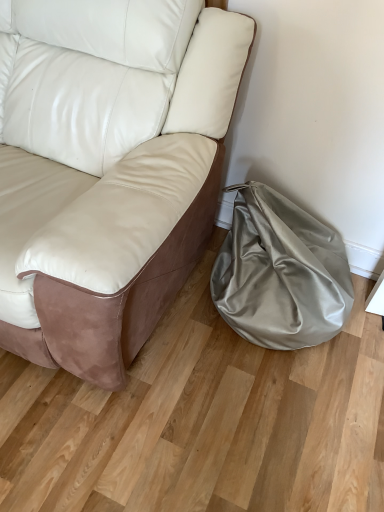
Question: In the image, is satin beige bean bag at lower right on the left side or the right side of white leather couch at center?

Choices:
 (A) right
 (B) left

Answer: (A)

Question: Considering the positions of satin beige bean bag at lower right and white leather couch at center in the image, is satin beige bean bag at lower right wider or thinner than white leather couch at center?

Choices:
 (A) wide
 (B) thin

Answer: (B)

Question: From the image's perspective, relative to white leather couch at center, is satin beige bean bag at lower right above or below?

Choices:
 (A) below
 (B) above

Answer: (A)

Question: From a real-world perspective, relative to satin beige bean bag at lower right, is white leather couch at center vertically above or below?

Choices:
 (A) above
 (B) below

Answer: (A)

Question: Would you say white leather couch at center is to the left or to the right of satin beige bean bag at lower right in the picture?

Choices:
 (A) right
 (B) left

Answer: (B)

Question: Is white leather couch at center bigger or smaller than satin beige bean bag at lower right?

Choices:
 (A) big
 (B) small

Answer: (A)

Question: Considering their positions, is white leather couch at center located in front of or behind satin beige bean bag at lower right?

Choices:
 (A) behind
 (B) front

Answer: (B)